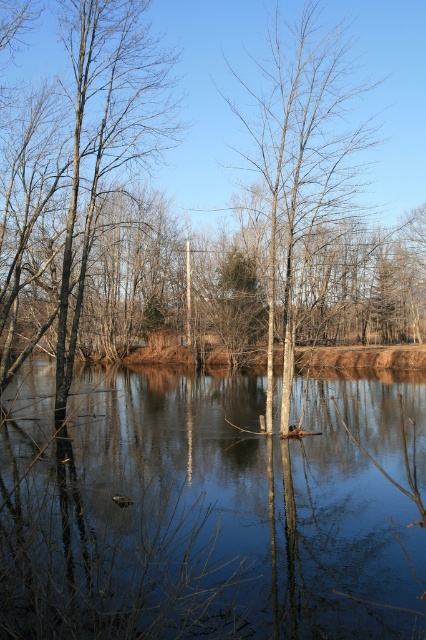
You are an artist planning to paint the scene. You want to ensure the transparent water at center and the bare wood tree at center are proportionally accurate. Which object should you paint larger?

The transparent water at center should be painted larger than the bare wood tree at center because the transparent water at center is bigger than the bare wood tree at center.

You are standing at the center of the image and want to walk towards the brown bark tree at left. In which direction should you move?

You should move to the left since the brown bark tree at left is positioned at point (81,170), which is to the left of the center.

You are standing at the edge of the water and want to take a photo of both the transparent water at center and the brown bark tree at left. Which object will appear larger in the photo?

The brown bark tree at left will appear larger in the photo because it occupies more space than the transparent water at center.